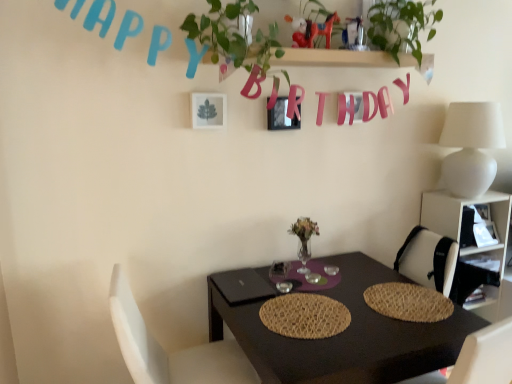
Question: Is point (374, 38) closer or farther from the camera than point (320, 354)?

Choices:
 (A) closer
 (B) farther

Answer: (B)

Question: Is green leafy plant at upper right taller or shorter than black matte table at center?

Choices:
 (A) tall
 (B) short

Answer: (B)

Question: Which is farther from the metallic silver picture frame at upper center, which is the 1th picture frame in back-to-front order?

Choices:
 (A) woven straw placemat at center, the 1th mat from the right
 (B) pink paper letter at upper center
 (C) white fabric chair at lower left
 (D) green leafy plant at upper center
 (E) white matte table lamp at upper right

Answer: (C)

Question: Estimate the real-world distances between objects in this image. Which object is farther from the green leafy plant at upper right?

Choices:
 (A) white plastic shelf at right
 (B) green leafy plant at upper center
 (C) white fabric chair at lower left
 (D) woven straw placemat at center, the second mat positioned from the left
 (E) woven straw placemat at center, arranged as the 2th mat when viewed from the right

Answer: (C)